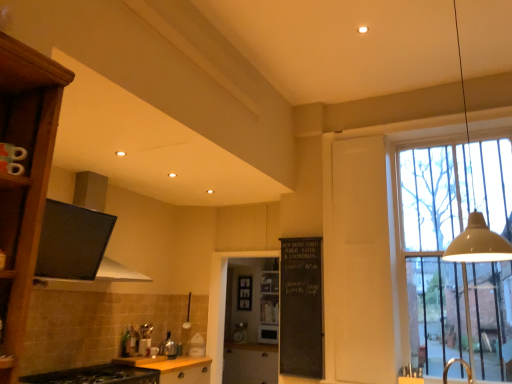
What is the approximate width of matte wood cabinet at center, which is the third cabinetry from front to back?

28.71 inches.

The height and width of the screenshot is (384, 512). What do you see at coordinates (78, 246) in the screenshot?
I see `black matte exhaust hood at upper left` at bounding box center [78, 246].

Find the location of a particular element. This screenshot has width=512, height=384. black matte exhaust hood at upper left is located at coordinates (78, 246).

The height and width of the screenshot is (384, 512). Identify the location of matte black microwave at center, the 1th appliance positioned from the back. (268, 334).

The image size is (512, 384). What are the coordinates of `clear glass window at right` in the screenshot? It's located at (449, 244).

What do you see at coordinates (449, 244) in the screenshot? The image size is (512, 384). I see `clear glass window at right` at bounding box center [449, 244].

Describe the element at coordinates (251, 322) in the screenshot. This screenshot has width=512, height=384. I see `transparent glass screen door at center` at that location.

At what (x,y) coordinates should I click in order to perform the action: click on black matte cabinet at lower left, which is counted as the third cabinetry, starting from the bottom. Please return your answer as a coordinate pair (x, y). The height and width of the screenshot is (384, 512). Looking at the image, I should click on (135, 371).

Locate an element on the screen. black chalkboard at center is located at coordinates (301, 307).

Identify the location of matte wood cabinet at center, acting as the first cabinetry starting from the bottom. (250, 363).

Could you tell me if transparent glass screen door at center is turned towards clear glass window at right?

No.

Considering the relative positions of transparent glass screen door at center and clear glass window at right in the image provided, is transparent glass screen door at center in front of clear glass window at right?

No, it is behind clear glass window at right.

Which is closer to the camera, [236,328] or [504,158]?

Point [236,328] is farther from the camera than point [504,158].

Considering the sizes of objects transparent glass screen door at center and clear glass window at right in the image provided, who is shorter, transparent glass screen door at center or clear glass window at right?

With less height is transparent glass screen door at center.

Which of these two, transparent glass screen door at center or matte black microwave at center, the second appliance viewed from the front, stands taller?

transparent glass screen door at center is taller.

Which is nearer, (275,306) or (264,337)?

Point (275,306).

Considering the positions of objects transparent glass screen door at center and matte black microwave at center, which appears as the first appliance when viewed from the right, in the image provided, who is more to the right, transparent glass screen door at center or matte black microwave at center, which appears as the first appliance when viewed from the right,?

From the viewer's perspective, matte black microwave at center, which appears as the first appliance when viewed from the right, appears more on the right side.

From the image's perspective, which is below, wooden at center or black matte cabinet at lower left, the first cabinetry viewed from the top?

wooden at center.

Considering the relative positions of wooden at center and black matte cabinet at lower left, the first cabinetry viewed from the top, in the image provided, is wooden at center to the left or to the right of black matte cabinet at lower left, the first cabinetry viewed from the top,?

In the image, wooden at center appears on the right side of black matte cabinet at lower left, the first cabinetry viewed from the top.

Is wooden at center facing away from black matte cabinet at lower left, the 1th cabinetry from the front?

wooden at center is not turned away from black matte cabinet at lower left, the 1th cabinetry from the front.

Is black matte cabinet at lower left, the first cabinetry viewed from the top, surrounded by wooden at center?

No.

Between black matte cabinet at lower left, acting as the third cabinetry starting from the back, and black chalkboard at center, which one has larger size?

black matte cabinet at lower left, acting as the third cabinetry starting from the back.

Does black matte cabinet at lower left, acting as the third cabinetry starting from the back, have a lesser width compared to black chalkboard at center?

No.

Does point (98, 373) lie in front of point (322, 334)?

Yes, it is.

Consider the image. From the image's perspective, is black matte cabinet at lower left, which is counted as the third cabinetry, starting from the bottom, positioned above or below black chalkboard at center?

Based on their image positions, black matte cabinet at lower left, which is counted as the third cabinetry, starting from the bottom, is located beneath black chalkboard at center.

Is white glossy toaster at center, the 2th appliance when ordered from right to left, to the left or to the right of matte black microwave at center, the second appliance from the left, in the image?

white glossy toaster at center, the 2th appliance when ordered from right to left, is positioned on matte black microwave at center, the second appliance from the left,'s left side.

Based on the photo, is white glossy toaster at center, the first appliance in the top-to-bottom sequence, taller or shorter than matte black microwave at center, the first appliance in the bottom-to-top sequence?

white glossy toaster at center, the first appliance in the top-to-bottom sequence, is shorter than matte black microwave at center, the first appliance in the bottom-to-top sequence.

Is white glossy toaster at center, the first appliance in the front-to-back sequence, in contact with matte black microwave at center, the second appliance from the left?

No, white glossy toaster at center, the first appliance in the front-to-back sequence, is not making contact with matte black microwave at center, the second appliance from the left.

Considering the positions of objects matte black microwave at center, the second appliance from the left, and white glossy toaster at center, marked as the 2th appliance in a bottom-to-top arrangement, in the image provided, who is in front, matte black microwave at center, the second appliance from the left, or white glossy toaster at center, marked as the 2th appliance in a bottom-to-top arrangement,?

white glossy toaster at center, marked as the 2th appliance in a bottom-to-top arrangement.

Could white glossy toaster at center, the 1th appliance when ordered from left to right, be considered to be inside matte black microwave at center, the second appliance viewed from the front?

Actually, white glossy toaster at center, the 1th appliance when ordered from left to right, is outside matte black microwave at center, the second appliance viewed from the front.

Is matte black microwave at center, which appears as the first appliance when viewed from the right, oriented away from white glossy toaster at center, the first appliance in the top-to-bottom sequence?

No, matte black microwave at center, which appears as the first appliance when viewed from the right, is not facing the opposite direction of white glossy toaster at center, the first appliance in the top-to-bottom sequence.

Between white glossy toaster at center, marked as the 2th appliance in a bottom-to-top arrangement, and wooden at center, which one is positioned behind?

wooden at center is behind.

From their relative heights in the image, would you say white glossy toaster at center, the 2th appliance when ordered from right to left, is taller or shorter than wooden at center?

In the image, white glossy toaster at center, the 2th appliance when ordered from right to left, appears to be shorter than wooden at center.

Considering the relative positions of white glossy toaster at center, marked as the 2th appliance in a bottom-to-top arrangement, and wooden at center in the image provided, is white glossy toaster at center, marked as the 2th appliance in a bottom-to-top arrangement, to the right of wooden at center from the viewer's perspective?

In fact, white glossy toaster at center, marked as the 2th appliance in a bottom-to-top arrangement, is to the left of wooden at center.

Is white glossy toaster at center, the first appliance in the front-to-back sequence, looking in the opposite direction of wooden at center?

No, wooden at center is not at the back of white glossy toaster at center, the first appliance in the front-to-back sequence.

At what (x,y) coordinates should I click in order to perform the action: click on screen door lying on the left of clear glass window at right. Please return your answer as a coordinate pair (x, y). This screenshot has width=512, height=384. Looking at the image, I should click on (251, 322).

There is a transparent glass screen door at center. Find the location of `the 1st appliance below it (from a real-world perspective)`. the 1st appliance below it (from a real-world perspective) is located at coordinates (268, 334).

Considering their positions, is beige matte pendant lamp at upper right positioned closer to matte wood cabinet at center, marked as the 1th cabinetry in a back-to-front arrangement, than clear glass window at right?

clear glass window at right is positioned closer to the anchor matte wood cabinet at center, marked as the 1th cabinetry in a back-to-front arrangement.

From the image, which object appears to be farther from clear glass window at right, matte wood cabinet at center, which is the third cabinetry from front to back, or beige matte pendant lamp at upper right?

Based on the image, matte wood cabinet at center, which is the third cabinetry from front to back, appears to be further to clear glass window at right.

Looking at the image, which one is located closer to white glossy toaster at center, the 1th appliance when ordered from left to right, yellow matte cabinet at lower center, which ranks as the second cabinetry in back-to-front order, or black matte exhaust hood at upper left?

Among the two, yellow matte cabinet at lower center, which ranks as the second cabinetry in back-to-front order, is located nearer to white glossy toaster at center, the 1th appliance when ordered from left to right.

Looking at the image, which one is located further to black matte cabinet at lower left, the 1th cabinetry from the front, white glossy toaster at center, the 2th appliance when ordered from right to left, or beige matte pendant lamp at upper right?

beige matte pendant lamp at upper right is positioned further to the anchor black matte cabinet at lower left, the 1th cabinetry from the front.

Considering their positions, is matte black microwave at center, the 2th appliance positioned from the top, positioned further to transparent glass screen door at center than wooden at center?

Based on the image, matte black microwave at center, the 2th appliance positioned from the top, appears to be further to transparent glass screen door at center.

Based on their spatial positions, is matte wood cabinet at center, which is the third cabinetry from front to back, or beige matte pendant lamp at upper right further from wooden at center?

beige matte pendant lamp at upper right.

When comparing their distances from matte black microwave at center, the 2th appliance positioned from the top, does black matte exhaust hood at upper left or clear glass window at right seem further?

black matte exhaust hood at upper left is positioned further to the anchor matte black microwave at center, the 2th appliance positioned from the top.

Considering their positions, is black chalkboard at center positioned further to matte black microwave at center, the 1th appliance positioned from the back, than yellow matte cabinet at lower center, which appears as the second cabinetry when viewed from the front?

black chalkboard at center lies further to matte black microwave at center, the 1th appliance positioned from the back, than the other object.

Where is `window located between black matte exhaust hood at upper left and matte black microwave at center, the 1th appliance positioned from the back, in the depth direction`? The width and height of the screenshot is (512, 384). window located between black matte exhaust hood at upper left and matte black microwave at center, the 1th appliance positioned from the back, in the depth direction is located at coordinates (449, 244).

The image size is (512, 384). I want to click on bulletin board positioned between clear glass window at right and matte black microwave at center, the second appliance viewed from the front, from near to far, so click(301, 307).

The image size is (512, 384). What are the coordinates of `bulletin board between yellow matte cabinet at lower center, which appears as the second cabinetry when viewed from the front, and matte wood cabinet at center, marked as the 1th cabinetry in a back-to-front arrangement, in the front-back direction` in the screenshot? It's located at (301, 307).

Find the location of a particular element. appliance positioned between yellow matte cabinet at lower center, which ranks as the second cabinetry in back-to-front order, and matte black microwave at center, the first appliance in the bottom-to-top sequence, from near to far is located at coordinates (196, 346).